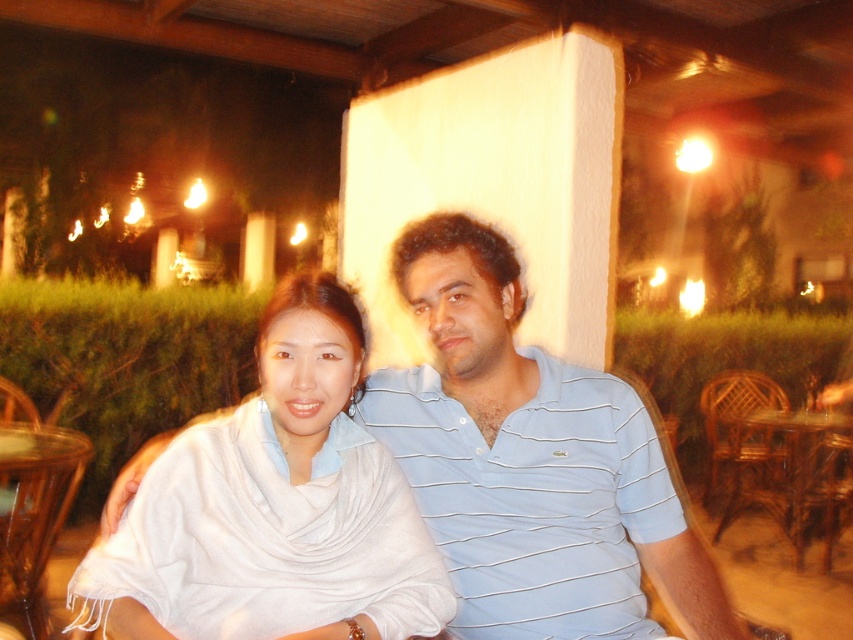
Does white silk scarf at center have a greater height compared to wooden at right?

Incorrect, white silk scarf at center's height is not larger of wooden at right's.

Is white silk scarf at center above wooden at right?

Yes, white silk scarf at center is above wooden at right.

Between point (299, 369) and point (839, 477), which one is positioned in front?

Point (299, 369) is more forward.

This screenshot has width=853, height=640. I want to click on white silk scarf at center, so click(x=311, y=490).

Which of these two, light blue striped polo shirt at center or wooden table at lower left, stands shorter?

wooden table at lower left

Between point (392, 440) and point (4, 515), which one is positioned in front?

Point (392, 440) is in front.

Locate an element on the screen. light blue striped polo shirt at center is located at coordinates (531, 461).

Between wooden table at lower left and wooden at right, which one appears on the right side from the viewer's perspective?

From the viewer's perspective, wooden at right appears more on the right side.

Is wooden table at lower left thinner than wooden at right?

Yes, wooden table at lower left is thinner than wooden at right.

Does point (22, 552) come behind point (822, 480)?

No, (22, 552) is closer to viewer.

This screenshot has height=640, width=853. Find the location of `wooden table at lower left`. wooden table at lower left is located at coordinates (35, 513).